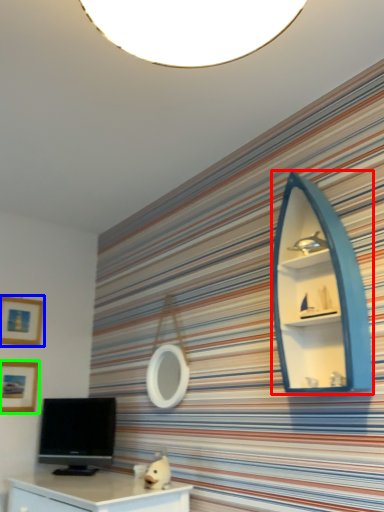
Question: Based on their relative distances, which object is nearer to shelf (highlighted by a red box)? Choose from picture frame (highlighted by a blue box) and picture frame (highlighted by a green box).

Choices:
 (A) picture frame
 (B) picture frame

Answer: (A)